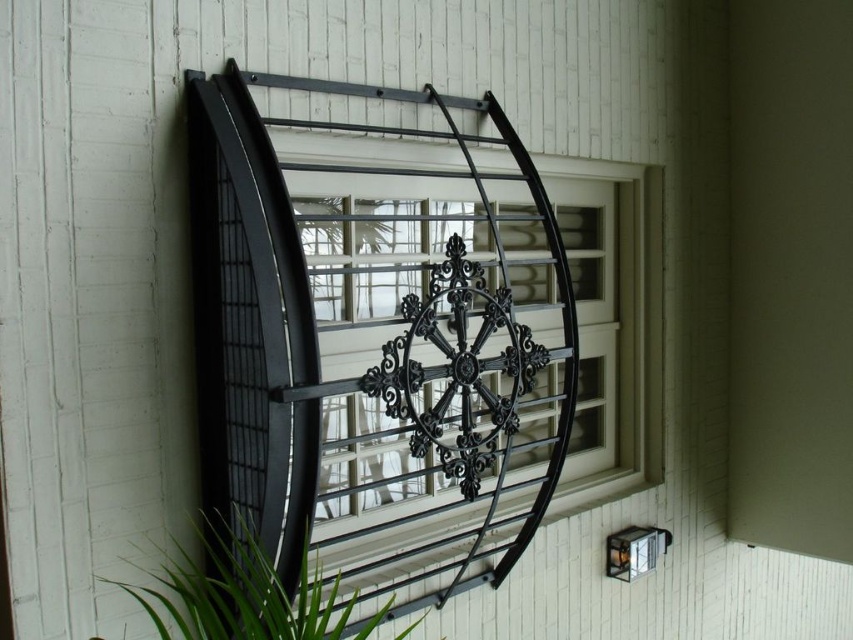
Between point (494, 420) and point (230, 609), which one is positioned behind?

Positioned behind is point (494, 420).

Does black metal/iron at upper center have a greater height compared to green leafy plant at lower left?

Yes, black metal/iron at upper center is taller than green leafy plant at lower left.

Is point (488, 172) farther from viewer compared to point (328, 616)?

Yes, point (488, 172) is behind point (328, 616).

Image resolution: width=853 pixels, height=640 pixels. Find the location of `black metal/iron at upper center`. black metal/iron at upper center is located at coordinates (412, 333).